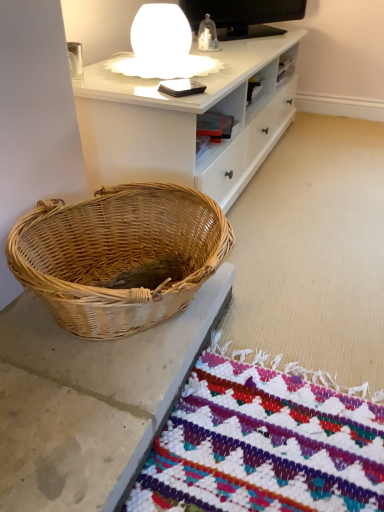
Measure the distance between point (166,199) and camera.

They are 1.02 meters apart.

Image resolution: width=384 pixels, height=512 pixels. What do you see at coordinates (119, 256) in the screenshot?
I see `woven natural basket at lower left` at bounding box center [119, 256].

What is the approximate width of woven natural basket at lower left?

woven natural basket at lower left is 16.61 inches in width.

You are a GUI agent. You are given a task and a screenshot of the screen. Output one action in this format:
    pyautogui.click(x=<x>, y=<y>)
    Task: Click on the woven natural basket at lower left
    
    Given the screenshot: What is the action you would take?
    pyautogui.click(x=119, y=256)

In order to face white matte table lamp at upper center, should I rotate leftwards or rightwards?

Turn left approximately 3.944 degrees to face it.

What is the approximate width of white matte table lamp at upper center?

white matte table lamp at upper center is 14.64 inches wide.

Describe the element at coordinates (161, 47) in the screenshot. I see `white matte table lamp at upper center` at that location.

This screenshot has height=512, width=384. I want to click on white matte table lamp at upper center, so [x=161, y=47].

You are a GUI agent. You are given a task and a screenshot of the screen. Output one action in this format:
    pyautogui.click(x=<x>, y=<y>)
    Task: Click on the woven natural basket at lower left
    
    Given the screenshot: What is the action you would take?
    pyautogui.click(x=119, y=256)

Does white matte table lamp at upper center appear on the left side of woven natural basket at lower left?

Incorrect, white matte table lamp at upper center is not on the left side of woven natural basket at lower left.

Relative to woven natural basket at lower left, is white matte table lamp at upper center in front or behind?

Clearly, white matte table lamp at upper center is behind woven natural basket at lower left.

Does point (180, 69) appear closer or farther from the camera than point (123, 187)?

Point (180, 69) appears to be farther away from the viewer than point (123, 187).

From the image's perspective, which one is positioned lower, white matte table lamp at upper center or woven natural basket at lower left?

woven natural basket at lower left appears lower in the image.

From a real-world perspective, is white matte table lamp at upper center on woven natural basket at lower left?

Yes, from a real-world perspective, white matte table lamp at upper center is over woven natural basket at lower left

Considering the sizes of white matte table lamp at upper center and woven natural basket at lower left in the image, is white matte table lamp at upper center wider or thinner than woven natural basket at lower left?

Clearly, white matte table lamp at upper center has less width compared to woven natural basket at lower left.

From the picture: In terms of height, does white matte table lamp at upper center look taller or shorter compared to woven natural basket at lower left?

white matte table lamp at upper center is shorter than woven natural basket at lower left.

In terms of size, does white matte table lamp at upper center appear bigger or smaller than woven natural basket at lower left?

Clearly, white matte table lamp at upper center is smaller in size than woven natural basket at lower left.

Is white matte table lamp at upper center inside or outside of woven natural basket at lower left?

white matte table lamp at upper center is spatially situated outside woven natural basket at lower left.

From the picture: Is white matte table lamp at upper center next to woven natural basket at lower left and touching it?

white matte table lamp at upper center is not next to woven natural basket at lower left, and they're not touching.

Does white matte table lamp at upper center turn towards woven natural basket at lower left?

No.

The width and height of the screenshot is (384, 512). I want to click on table lamp behind the woven natural basket at lower left, so 161,47.

Based on their positions, is woven natural basket at lower left located to the left or right of white matte table lamp at upper center?

woven natural basket at lower left is positioned on white matte table lamp at upper center's left side.

Consider the image. Does woven natural basket at lower left come in front of white matte table lamp at upper center?

That is True.

Is point (125, 216) closer or farther from the camera than point (198, 56)?

Point (125, 216) appears to be closer to the viewer than point (198, 56).

From the image's perspective, which is below, woven natural basket at lower left or white matte table lamp at upper center?

woven natural basket at lower left is shown below in the image.

From a real-world perspective, which is physically below, woven natural basket at lower left or white matte table lamp at upper center?

woven natural basket at lower left, from a real-world perspective.

Can you confirm if woven natural basket at lower left is thinner than white matte table lamp at upper center?

No, woven natural basket at lower left is not thinner than white matte table lamp at upper center.

Looking at this image, in terms of height, does woven natural basket at lower left look taller or shorter compared to white matte table lamp at upper center?

Clearly, woven natural basket at lower left is taller compared to white matte table lamp at upper center.

Between woven natural basket at lower left and white matte table lamp at upper center, which one has larger size?

woven natural basket at lower left.

Choose the correct answer: Is woven natural basket at lower left inside white matte table lamp at upper center or outside it?

woven natural basket at lower left is not inside white matte table lamp at upper center, it's outside.

Based on the photo, does woven natural basket at lower left touch white matte table lamp at upper center?

No, woven natural basket at lower left is not in contact with white matte table lamp at upper center.

Is woven natural basket at lower left oriented towards white matte table lamp at upper center?

No.

Looking at this image, can you tell me how much woven natural basket at lower left and white matte table lamp at upper center differ in facing direction?

woven natural basket at lower left and white matte table lamp at upper center are facing 2.64 degrees away from each other.

The image size is (384, 512). I want to click on picnic basket in front of the white matte table lamp at upper center, so click(119, 256).

Find the location of a particular element. picnic basket located below the white matte table lamp at upper center (from the image's perspective) is located at coordinates (119, 256).

The height and width of the screenshot is (512, 384). In order to click on table lamp on the right of woven natural basket at lower left in this screenshot , I will do `click(161, 47)`.